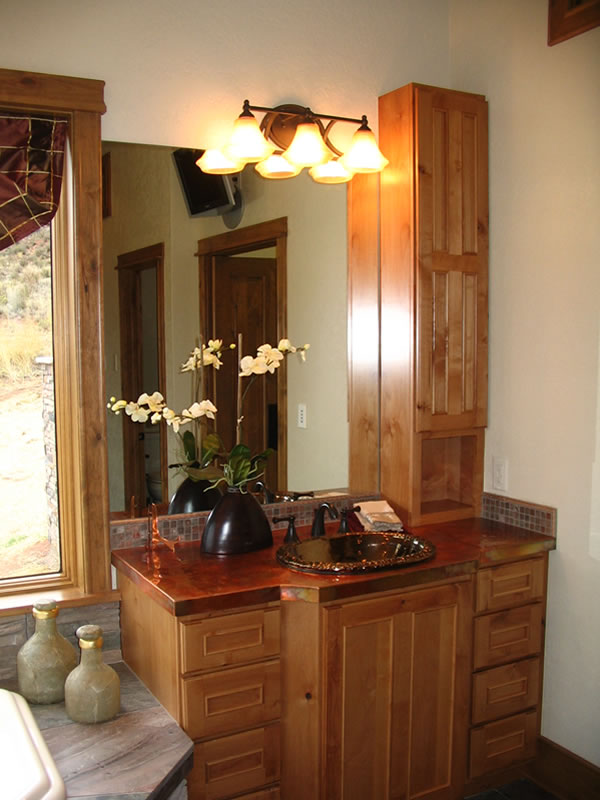
Image resolution: width=600 pixels, height=800 pixels. In order to click on potted plant in this screenshot , I will do `click(229, 486)`.